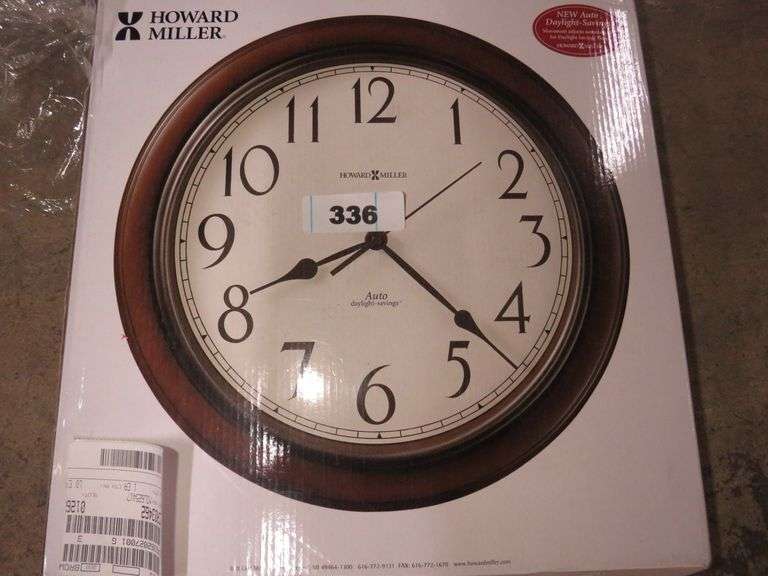
Where is `box`? The width and height of the screenshot is (768, 576). box is located at coordinates (664, 371).